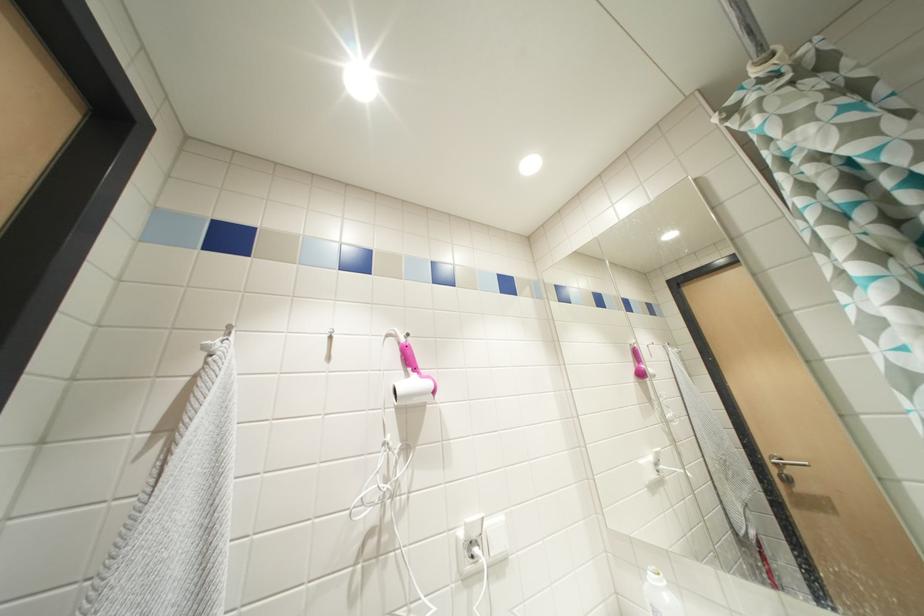
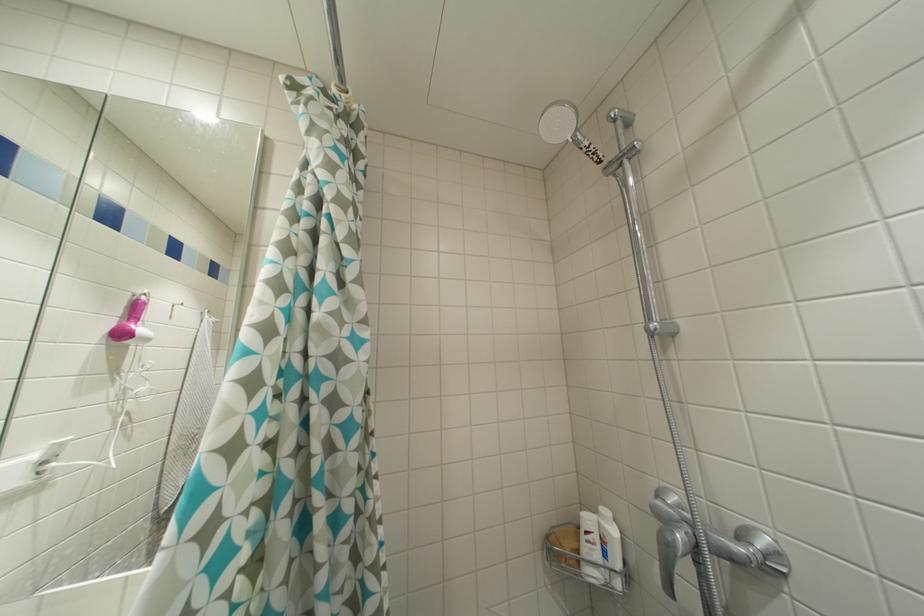
Question: How did the camera likely rotate?

Choices:
 (A) Left
 (B) Right
 (C) Up
 (D) Down

Answer: (B)